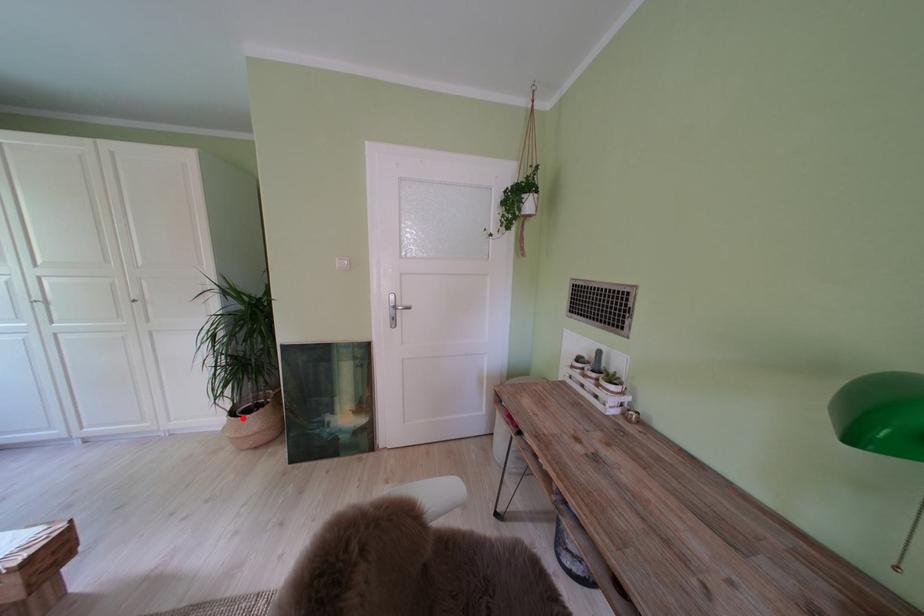
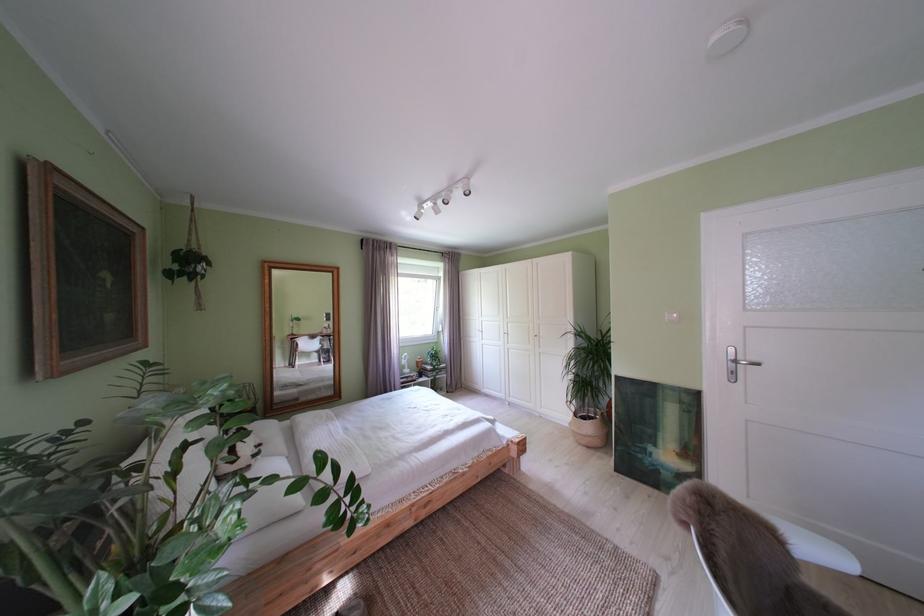
Question: I am providing you with two images of the same scene from different viewpoints. A red point is shown in image1. For the corresponding object point in image2, is it positioned nearer or farther from the camera?

Choices:
 (A) Nearer
 (B) Farther

Answer: (B)